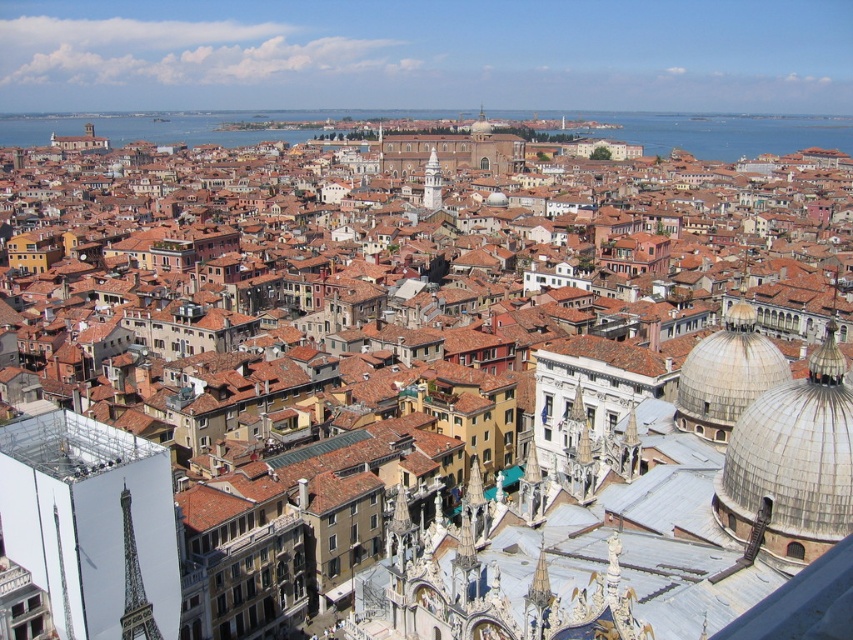
How much distance is there between white reflective tower at center and blue water at center?

A distance of 1903.71 feet exists between white reflective tower at center and blue water at center.

Is point (107, 556) positioned behind point (746, 152)?

No, it is not.

Where is `white reflective tower at center`? This screenshot has height=640, width=853. white reflective tower at center is located at coordinates (91, 524).

Can you confirm if blue water at center is positioned above smooth white dome at upper right?

Yes.

How distant is blue water at center from smooth white dome at upper right?

They are 547.57 meters apart.

Is point (274, 131) closer to viewer compared to point (723, 340)?

No, it is not.

The width and height of the screenshot is (853, 640). In order to click on blue water at center in this screenshot , I will do `click(724, 132)`.

Is white reflective tower at center to the left of white marble tower at center from the viewer's perspective?

Correct, you'll find white reflective tower at center to the left of white marble tower at center.

Which is below, white reflective tower at center or white marble tower at center?

white reflective tower at center is lower down.

Is point (1, 520) in front of point (436, 176)?

Yes, it is.

Where is `white reflective tower at center`? white reflective tower at center is located at coordinates (91, 524).